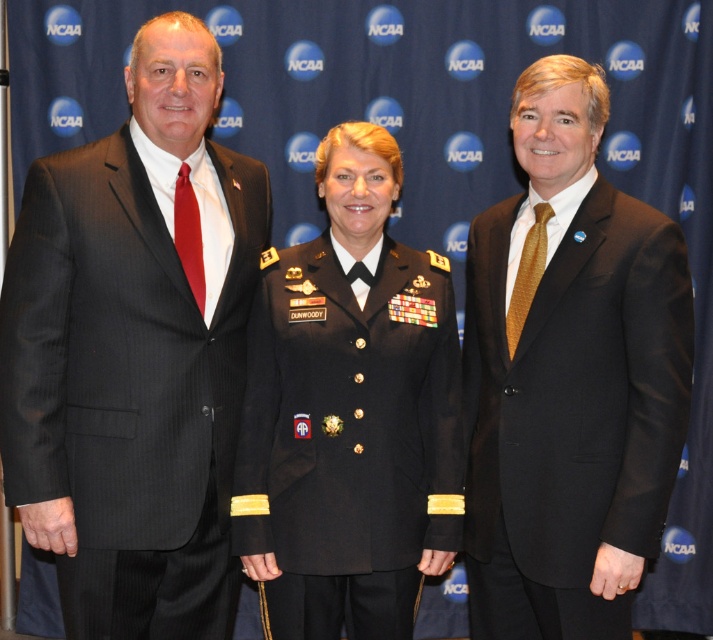
Where is the matte black suit at left located in the image?

The matte black suit at left is located at point (133, 352).

You are a photographer trying to position a spotlight on the person wearing the matte black suit at left in the image. The coordinates given are in normalized image coordinates where the origin is at the bottom left corner. Can you confirm if the point at (133, 352) is on the matte black suit at left?

Yes, the point at (133, 352) is on the matte black suit at left as per the provided coordinates.